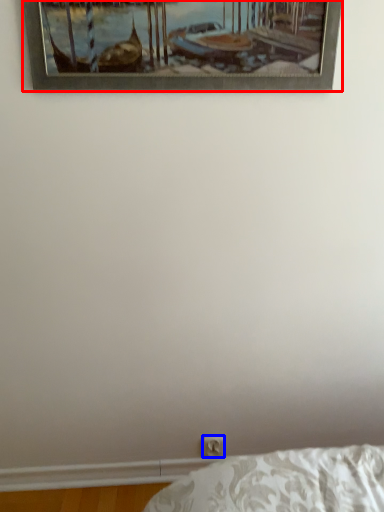
Question: Which object appears closest to the camera in this image, picture frame (highlighted by a red box) or electric outlet (highlighted by a blue box)?

Choices:
 (A) picture frame
 (B) electric outlet

Answer: (A)